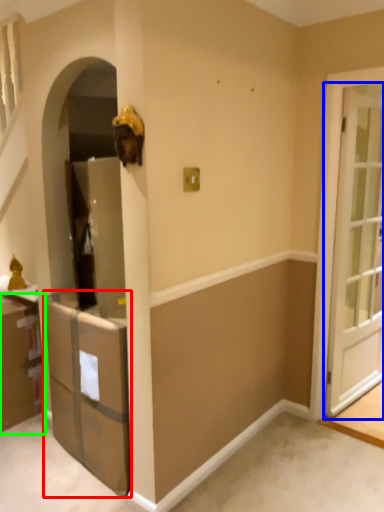
Question: Based on their relative distances, which object is farther from cabinetry (highlighted by a red box)? Choose from door (highlighted by a blue box) and cabinetry (highlighted by a green box).

Choices:
 (A) door
 (B) cabinetry

Answer: (A)